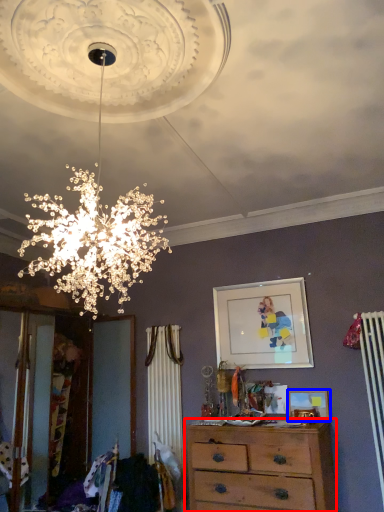
Question: Which point is further to the camera, chest of drawers (highlighted by a red box) or picture frame (highlighted by a blue box)?

Choices:
 (A) chest of drawers
 (B) picture frame

Answer: (B)